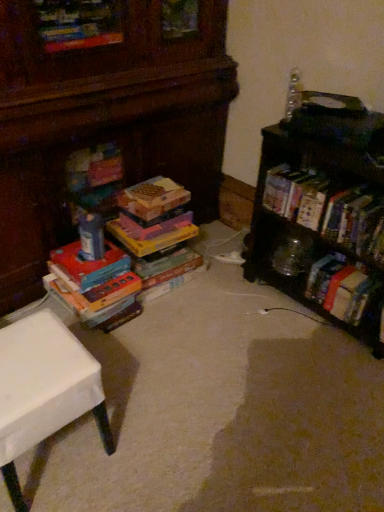
Question: Is white matte table at lower left surrounded by hardcover book at right, arranged as the 2th book when viewed from the left?

Choices:
 (A) yes
 (B) no

Answer: (B)

Question: From the image's perspective, is hardcover book at right, the 1th book positioned from the right, above white matte table at lower left?

Choices:
 (A) yes
 (B) no

Answer: (A)

Question: Is hardcover book at right, the 1th book positioned from the right, in contact with white matte table at lower left?

Choices:
 (A) no
 (B) yes

Answer: (A)

Question: Does hardcover book at right, arranged as the 2th book when viewed from the left, turn towards white matte table at lower left?

Choices:
 (A) no
 (B) yes

Answer: (B)

Question: Is hardcover book at right, the 1th book positioned from the right, closer to the viewer compared to white matte table at lower left?

Choices:
 (A) no
 (B) yes

Answer: (A)

Question: From the image's perspective, would you say hardcover book at right, the 1th book positioned from the right, is shown under white matte table at lower left?

Choices:
 (A) yes
 (B) no

Answer: (B)

Question: Is hardcover book at right, arranged as the 2th book when viewed from the left, placed right next to multicolored cardboard books at left, which is the first book in left-to-right order?

Choices:
 (A) yes
 (B) no

Answer: (B)

Question: Is hardcover book at right, the 1th book positioned from the right, facing towards multicolored cardboard books at left, the 2th book in the right-to-left sequence?

Choices:
 (A) no
 (B) yes

Answer: (A)

Question: Considering the relative sizes of hardcover book at right, the 1th book positioned from the right, and multicolored cardboard books at left, the 2th book in the right-to-left sequence, in the image provided, is hardcover book at right, the 1th book positioned from the right, taller than multicolored cardboard books at left, the 2th book in the right-to-left sequence,?

Choices:
 (A) no
 (B) yes

Answer: (A)

Question: Does hardcover book at right, the 1th book positioned from the right, have a lesser height compared to multicolored cardboard books at left, the 2th book in the right-to-left sequence?

Choices:
 (A) yes
 (B) no

Answer: (A)

Question: Is there a large distance between hardcover book at right, the 1th book positioned from the right, and multicolored cardboard books at left, the 2th book in the right-to-left sequence?

Choices:
 (A) yes
 (B) no

Answer: (A)

Question: From a real-world perspective, is hardcover book at right, arranged as the 2th book when viewed from the left, beneath multicolored cardboard books at left, which is the first book in left-to-right order?

Choices:
 (A) yes
 (B) no

Answer: (B)

Question: Does clear plastic bottle at upper right, which is the second toy from left to right, have a greater height compared to wooden bookshelf at right?

Choices:
 (A) yes
 (B) no

Answer: (B)